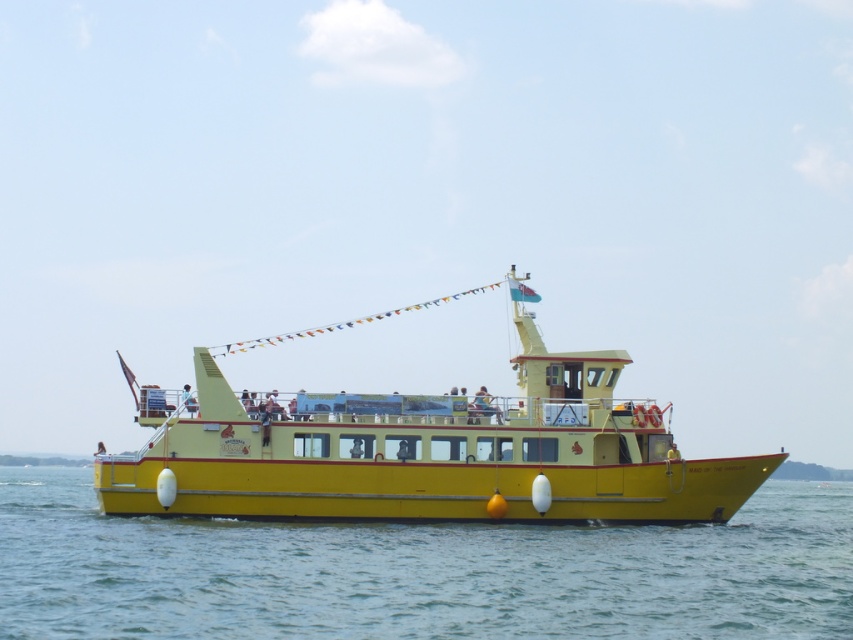
You are standing on the deck of the yellow matte boat at center. Looking down, you see the yellow matte water at lower center. Which object is closer to you?

The yellow matte boat at center is closer to you since you are standing on it, while the yellow matte water at lower center is located below it.

You are a passenger on the yellow passenger ferry boat and want to take a photo of the yellow matte water at lower center. Where should you position yourself to capture it in the frame?

You should position yourself at point (418, 572) to capture the yellow matte water at lower center in the frame.

You are a safety inspector on the yellow matte boat at center. You need to ensure that the yellow matte water at lower center is at least 10 meters away from the boat for safety regulations. Based on the image, is the current distance compliant?

The distance of yellow matte water at lower center from yellow matte boat at center is 8.40 meters, which is less than the required 10 meters. Therefore, the current distance does not comply with safety regulations.